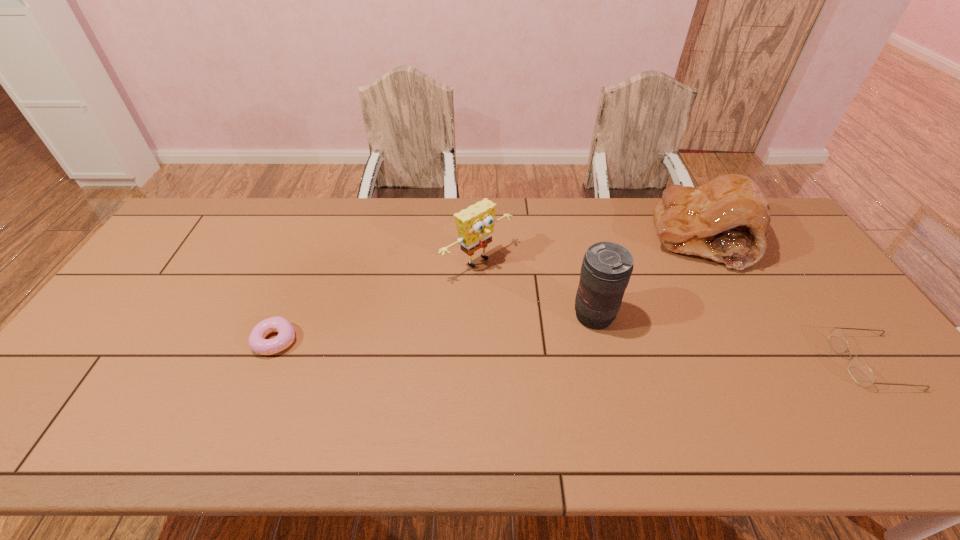
The image size is (960, 540). I want to click on free spot on the desktop that is between the leftmost object and the spectacles and is positioned on the filling side of the bread, so click(553, 350).

This screenshot has width=960, height=540. I want to click on free space on the desktop that is between the doughnut and the spectacles and is positioned on the face of the sponge, so click(x=593, y=352).

This screenshot has width=960, height=540. I want to click on vacant space on the desktop that is between the leftmost object and the spectacles and is positioned on the side of the telephoto lens where the control switches are located, so click(538, 350).